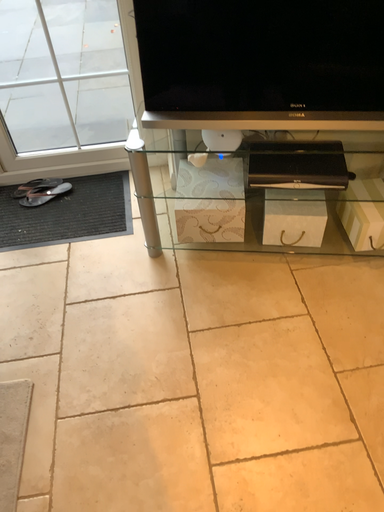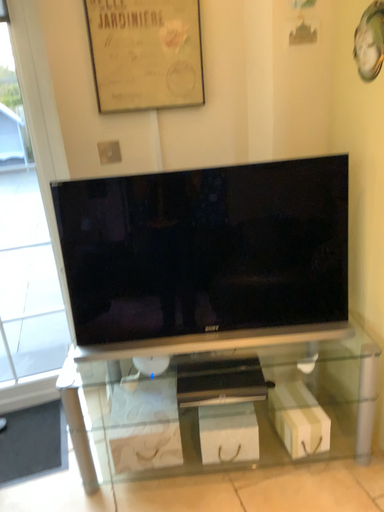
Question: How did the camera likely rotate when shooting the video?

Choices:
 (A) rotated upward
 (B) rotated downward

Answer: (A)